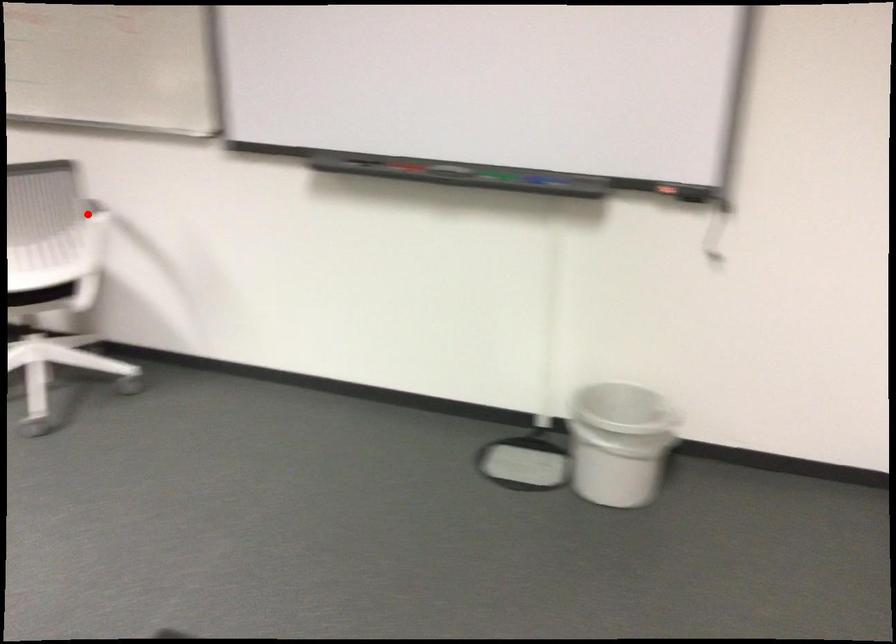
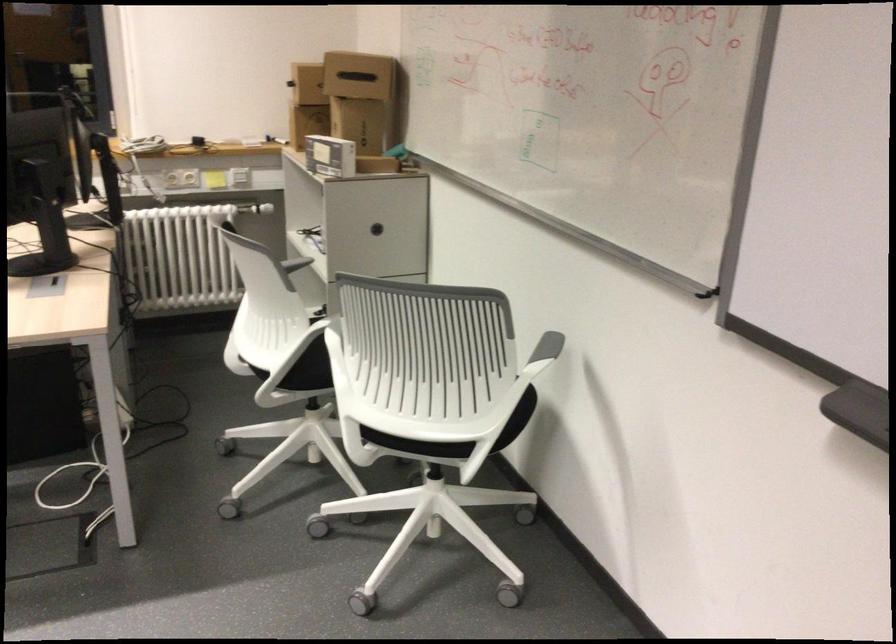
Question: I am providing you with two images of the same scene from different viewpoints. A red point is marked on the first image. Can you still see the location of the red point in image 2?

Choices:
 (A) Yes
 (B) No

Answer: (A)